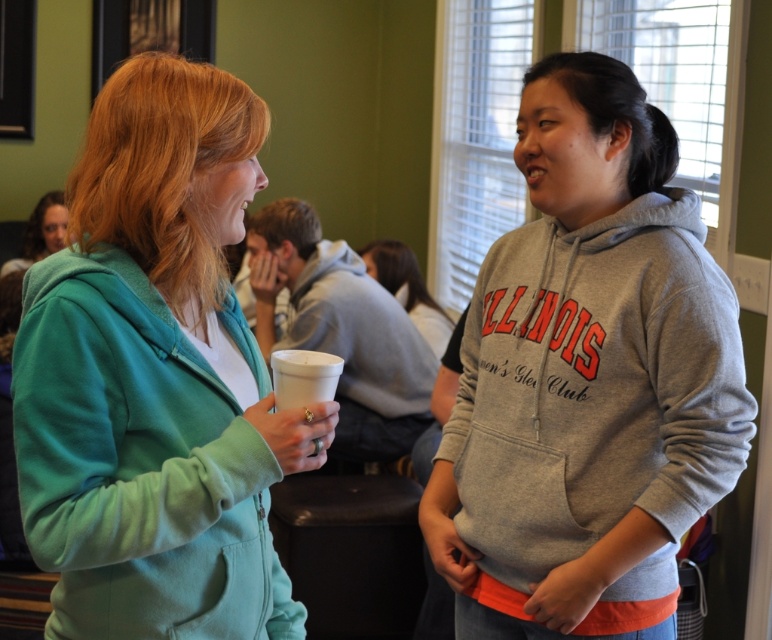
Question: Which object is positioned farthest from the white matte cup at center?

Choices:
 (A) white styrofoam cup at center
 (B) matte green hoodie at left
 (C) matte green hoodie at upper left
 (D) gray fleece hoodie at right

Answer: (A)

Question: Which is farther from the white styrofoam cup at center?

Choices:
 (A) matte green hoodie at left
 (B) matte green hoodie at upper left
 (C) white matte cup at center
 (D) gray fleece hoodie at center

Answer: (B)

Question: Can you confirm if matte green hoodie at left is smaller than gray fleece hoodie at center?

Choices:
 (A) yes
 (B) no

Answer: (B)

Question: Which object is closer to the camera taking this photo?

Choices:
 (A) white matte cup at center
 (B) gray fleece hoodie at right
 (C) matte green hoodie at upper left

Answer: (B)

Question: Is gray fleece hoodie at center to the left of matte green hoodie at upper left from the viewer's perspective?

Choices:
 (A) no
 (B) yes

Answer: (A)

Question: Does matte green hoodie at left come in front of white styrofoam cup at center?

Choices:
 (A) no
 (B) yes

Answer: (B)